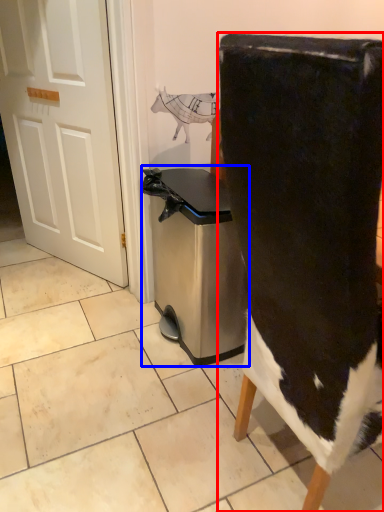
Question: Which object is closer to the camera taking this photo, chair (highlighted by a red box) or dish washer (highlighted by a blue box)?

Choices:
 (A) chair
 (B) dish washer

Answer: (A)